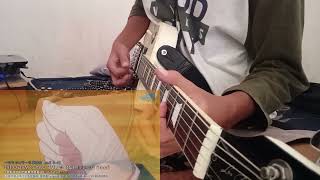
Find the location of `table`. table is located at coordinates tap(18, 141).